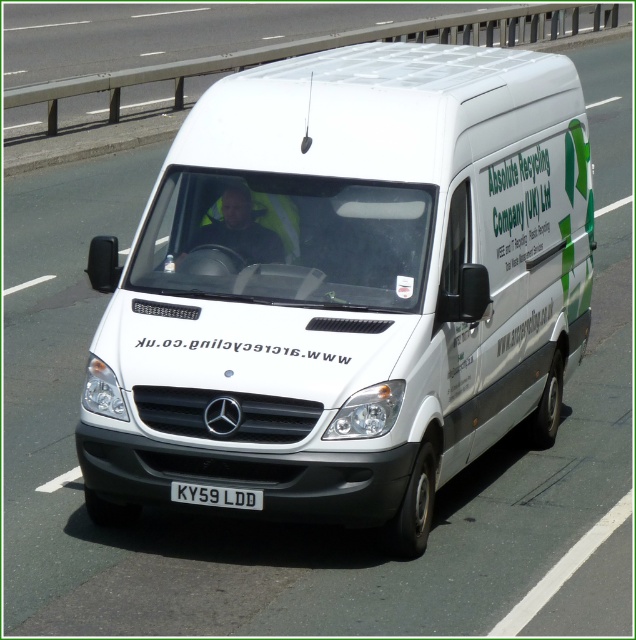
Is white matte van at center bigger than white plastic license plate at center?

Correct, white matte van at center is larger in size than white plastic license plate at center.

Is white matte van at center closer to the viewer compared to white plastic license plate at center?

Yes, it is.

Is point (349, 337) farther from viewer compared to point (240, 499)?

Yes, point (349, 337) is behind point (240, 499).

In order to click on white matte van at center in this screenshot , I will do `click(349, 288)`.

Is reflective yellow vest at center above white plastic license plate at center?

Indeed, reflective yellow vest at center is positioned over white plastic license plate at center.

The height and width of the screenshot is (640, 636). What do you see at coordinates (238, 228) in the screenshot?
I see `reflective yellow vest at center` at bounding box center [238, 228].

In the scene shown: Who is more forward, (233, 250) or (184, 496)?

Point (184, 496)

What are the coordinates of `reflective yellow vest at center` in the screenshot? It's located at (238, 228).

Which of these two, white matte van at center or reflective yellow vest at center, stands shorter?

reflective yellow vest at center is shorter.

Is white matte van at center smaller than reflective yellow vest at center?

Incorrect, white matte van at center is not smaller in size than reflective yellow vest at center.

At what (x,y) coordinates should I click in order to perform the action: click on white matte van at center. Please return your answer as a coordinate pair (x, y). Looking at the image, I should click on point(349,288).

Identify the location of white matte van at center. This screenshot has width=636, height=640. (349, 288).